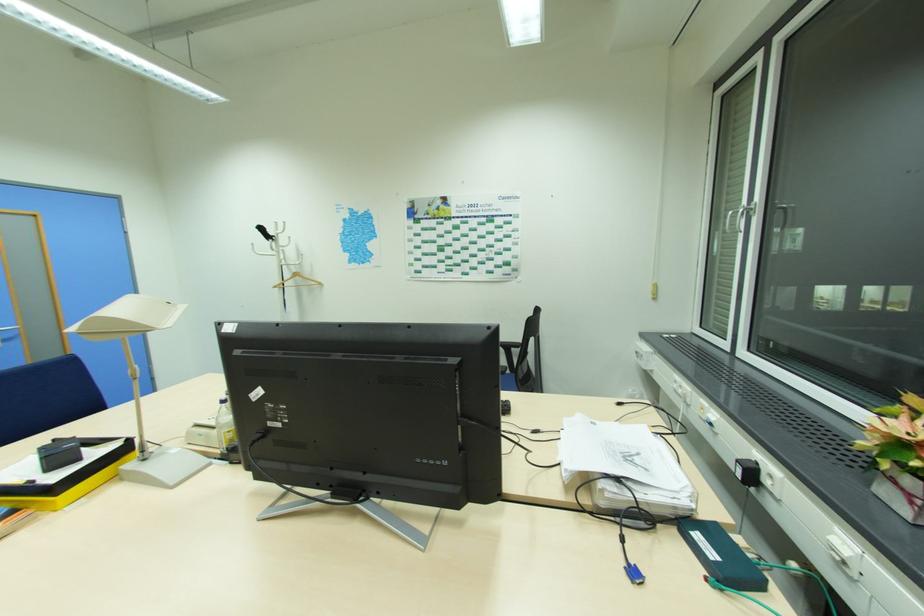
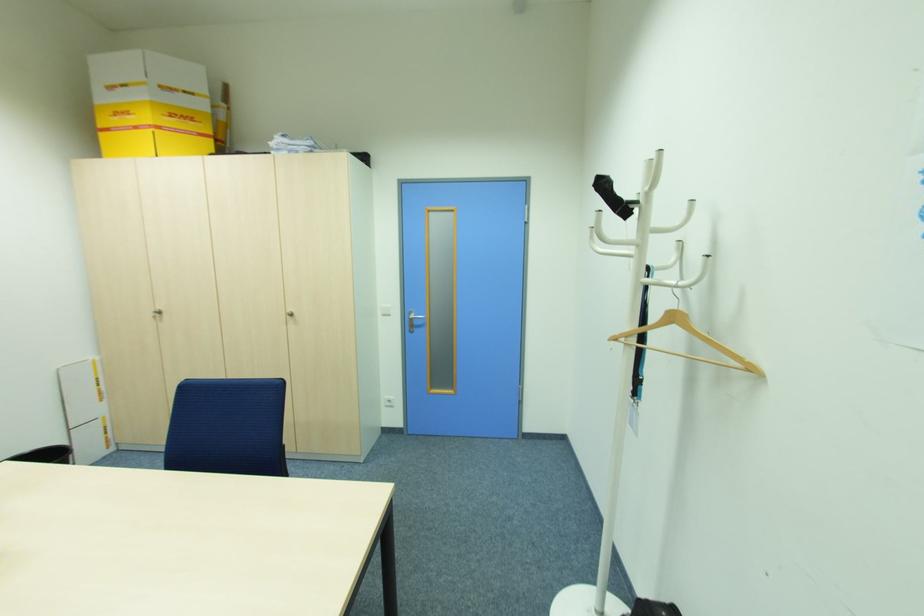
Locate, in the second image, the point that corresponds to (290,238) in the first image.

(688, 204)